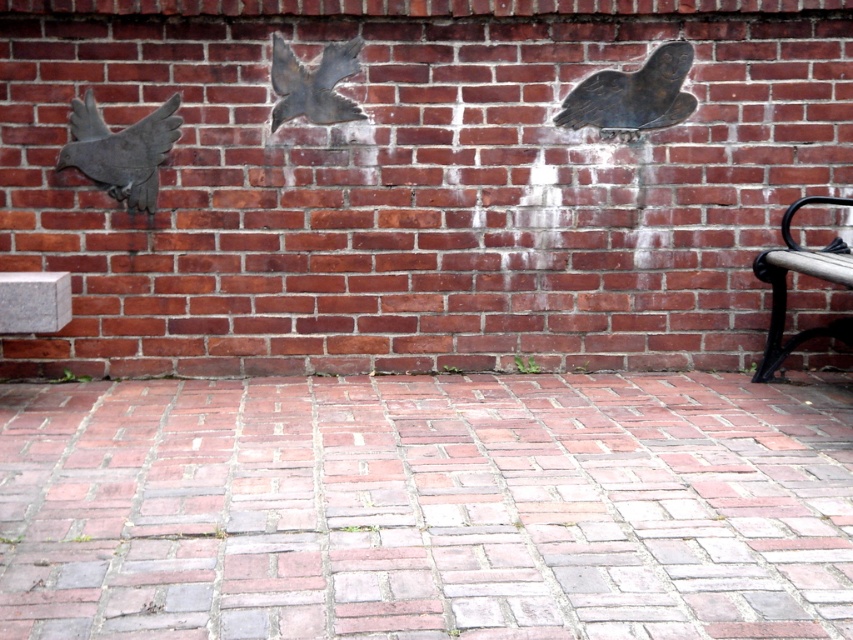
Question: Does brushed metal pigeon at left appear on the left side of shiny metallic pigeon at center?

Choices:
 (A) yes
 (B) no

Answer: (A)

Question: Can you confirm if black metal bench at right is positioned above shiny metallic pigeon at center?

Choices:
 (A) no
 (B) yes

Answer: (A)

Question: Which point appears farthest from the camera in this image?

Choices:
 (A) (102, 180)
 (B) (323, 122)

Answer: (B)

Question: Which of the following is the closest to the observer?

Choices:
 (A) coord(755,376)
 (B) coord(334,109)
 (C) coord(607,136)
 (D) coord(161,152)

Answer: (D)

Question: Which object is the closest to the black metal bench at right?

Choices:
 (A) brushed metal pigeon at upper right
 (B) shiny metallic pigeon at center
 (C) brushed metal pigeon at left

Answer: (A)

Question: Where is brushed metal pigeon at upper right located in relation to black metal bench at right in the image?

Choices:
 (A) right
 (B) left

Answer: (B)